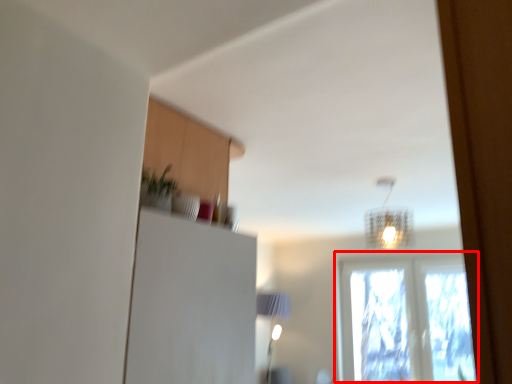
Question: Observing the image, what is the correct spatial positioning of window (annotated by the red box) in reference to lamp?

Choices:
 (A) left
 (B) right

Answer: (B)